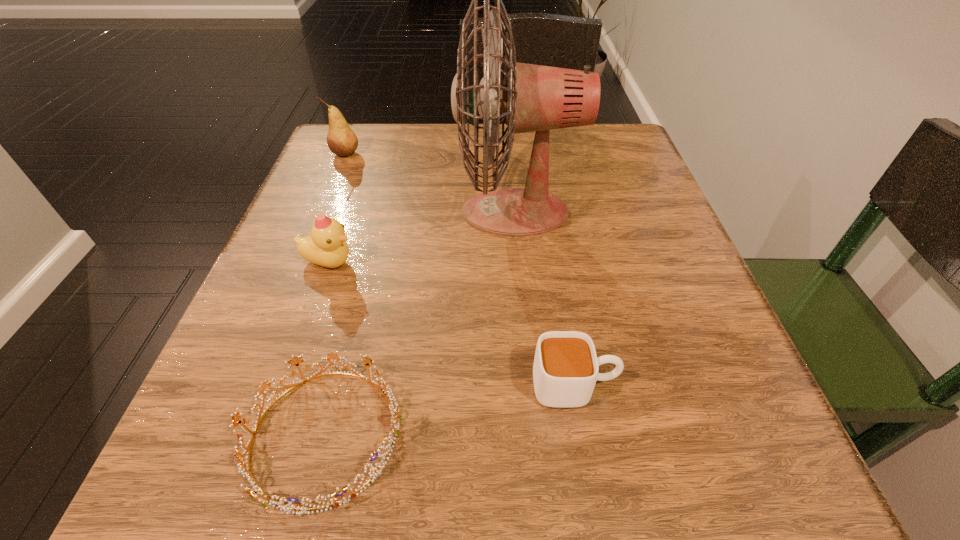
This screenshot has width=960, height=540. I want to click on object that is at the near left corner, so click(x=395, y=415).

Identify the location of vacant region at the near edge of the desktop. Image resolution: width=960 pixels, height=540 pixels. (479, 510).

Find the location of a particular element. The image size is (960, 540). free spot at the left edge of the desktop is located at coordinates (353, 219).

At what (x,y) coordinates should I click in order to perform the action: click on vacant space at the right edge. Please return your answer as a coordinate pair (x, y). Looking at the image, I should click on (620, 229).

This screenshot has width=960, height=540. I want to click on free space at the far left corner of the desktop, so click(x=372, y=150).

The width and height of the screenshot is (960, 540). I want to click on free region at the near left corner of the desktop, so click(277, 441).

This screenshot has width=960, height=540. In order to click on vacant space at the far right corner of the desktop in this screenshot , I will do `click(621, 135)`.

At what (x,y) coordinates should I click in order to perform the action: click on free area in between the duckling and the tiara. Please return your answer as a coordinate pair (x, y). This screenshot has width=960, height=540. Looking at the image, I should click on (327, 349).

I want to click on vacant region between the tiara and the third tallest object, so click(x=327, y=349).

Identify the location of vacant space that is in between the pear and the third tallest object. (338, 208).